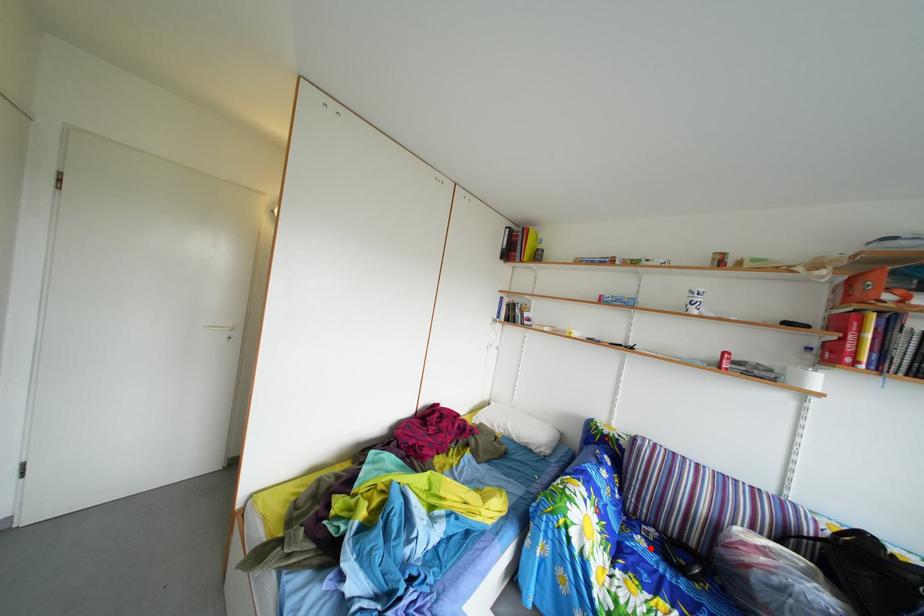
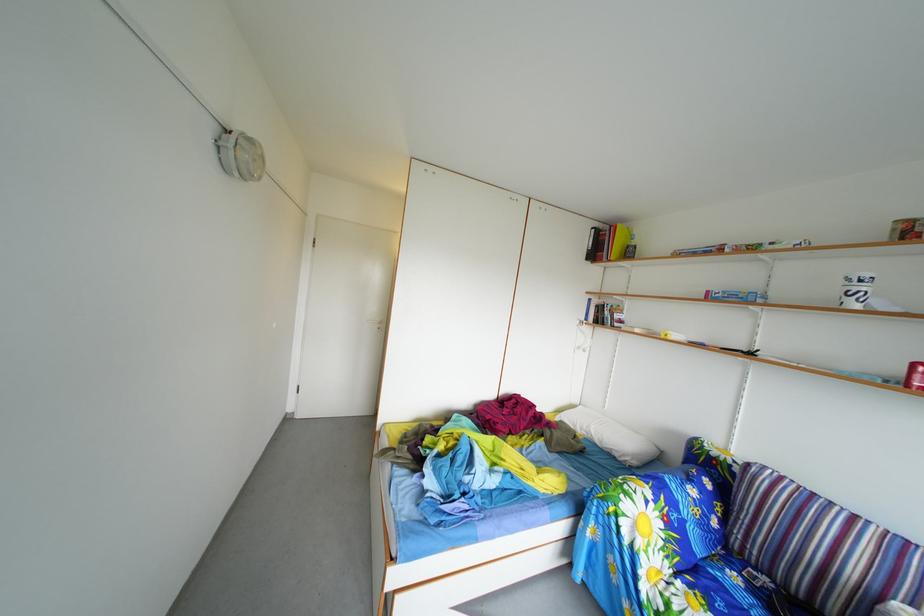
In the second image, find the point that corresponds to the highlighted location in the first image.

(746, 585)